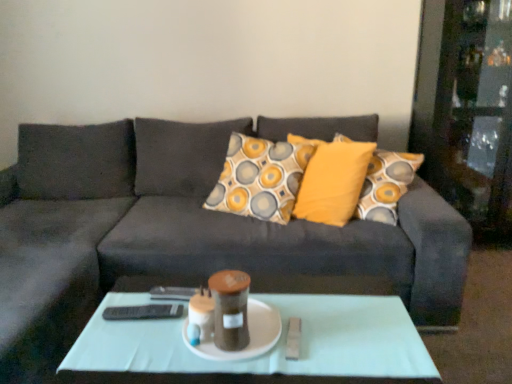
The image size is (512, 384). Find the location of `free space to the left of white ceramic plate at center`. free space to the left of white ceramic plate at center is located at coordinates point(133,337).